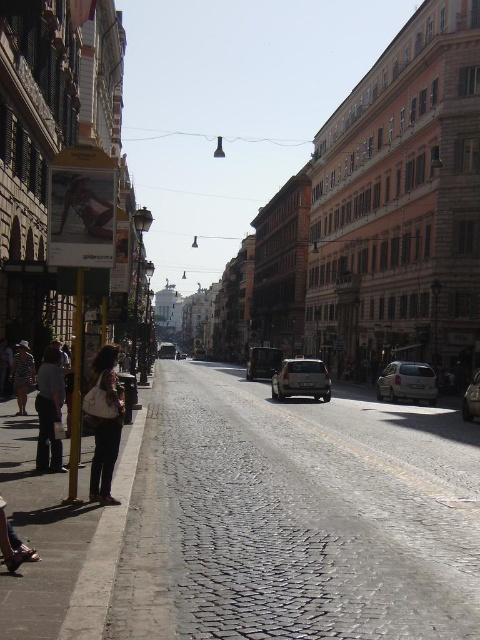
You are a tourist standing at the center of the cobblestone street in Rome. You want to take a photo of the yellow pole with the signboard advertisement. To do this, you need to walk towards the yellow pole. However, there is a person with dark brown hair at lower left blocking your path. Where should you move to avoid them?

The person with dark brown hair at lower left is located at coordinates point (105, 422). To avoid them, you should move to the right side of the street where there are fewer pedestrians and clear pathways.

You are standing at the yellow pole with a signboard on the left side of the cobblestone street. There are two points marked on the ground ahead of you. The first point is at coordinates point (96, 552) and the second is at point (50, 448). Which point is closer to you?

Point (96, 552) is in front of point (50, 448), so the first point is closer to you.